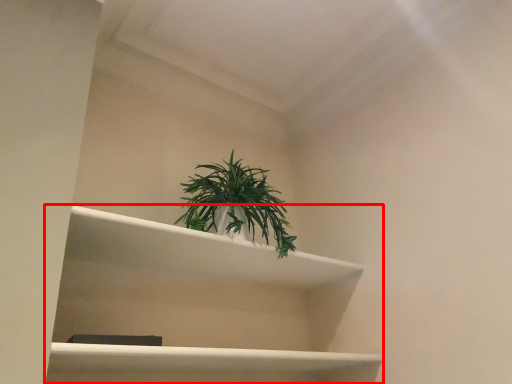
Question: From the image's perspective, where is shelf (annotated by the red box) located in relation to houseplant in the image?

Choices:
 (A) above
 (B) below

Answer: (B)